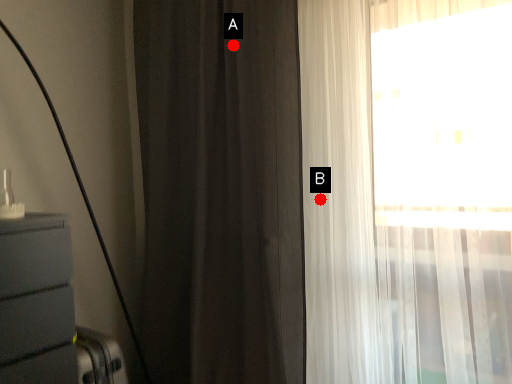
Question: Two points are circled on the image, labeled by A and B beside each circle. Which point is further to the camera?

Choices:
 (A) A is further
 (B) B is further

Answer: (A)